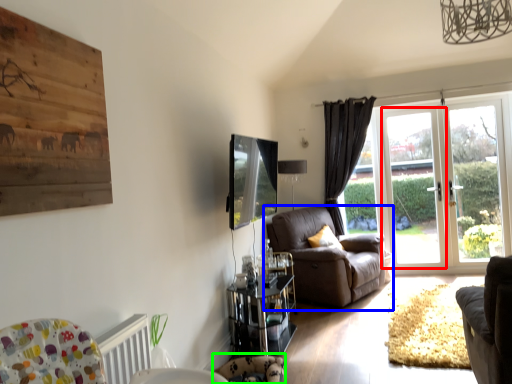
Question: Considering the real-world distances, which object is closest to screen door (highlighted by a red box)? chair (highlighted by a blue box) or swivel chair (highlighted by a green box).

Choices:
 (A) chair
 (B) swivel chair

Answer: (A)